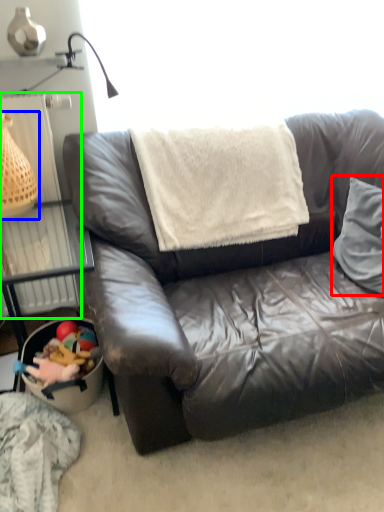
Question: Considering the real-world distances, which object is farthest from throw pillow (highlighted by a red box)? basket (highlighted by a blue box) or radiator (highlighted by a green box)?

Choices:
 (A) basket
 (B) radiator

Answer: (A)